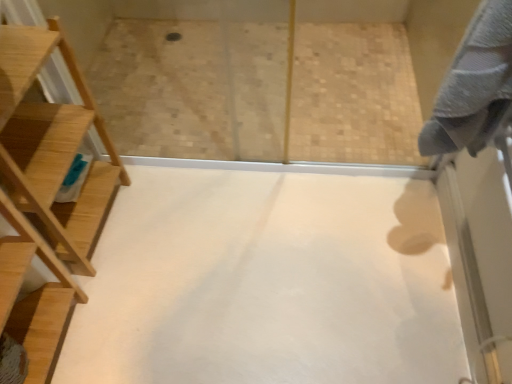
In order to click on vacant space in gray cotton bath towel at upper right (from a real-world perspective) in this screenshot , I will do `click(403, 246)`.